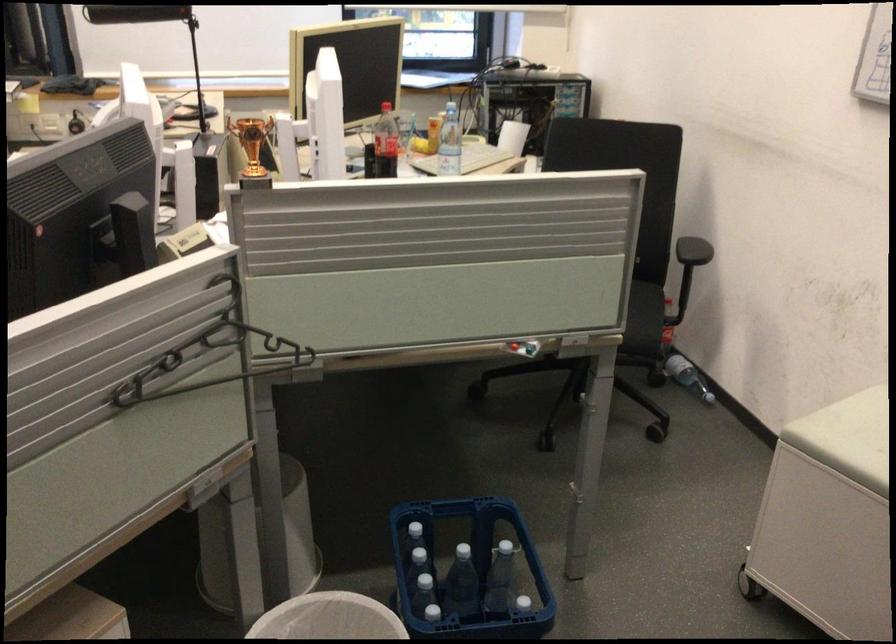
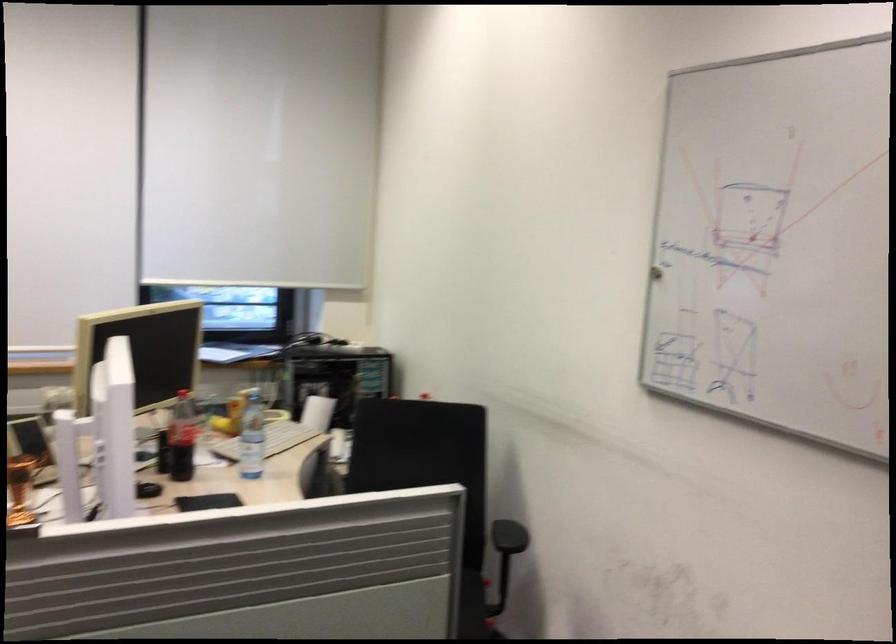
Question: The first image is from the beginning of the video and the second image is from the end. How did the camera likely rotate when shooting the video?

Choices:
 (A) Left
 (B) Right
 (C) Up
 (D) Down

Answer: (C)